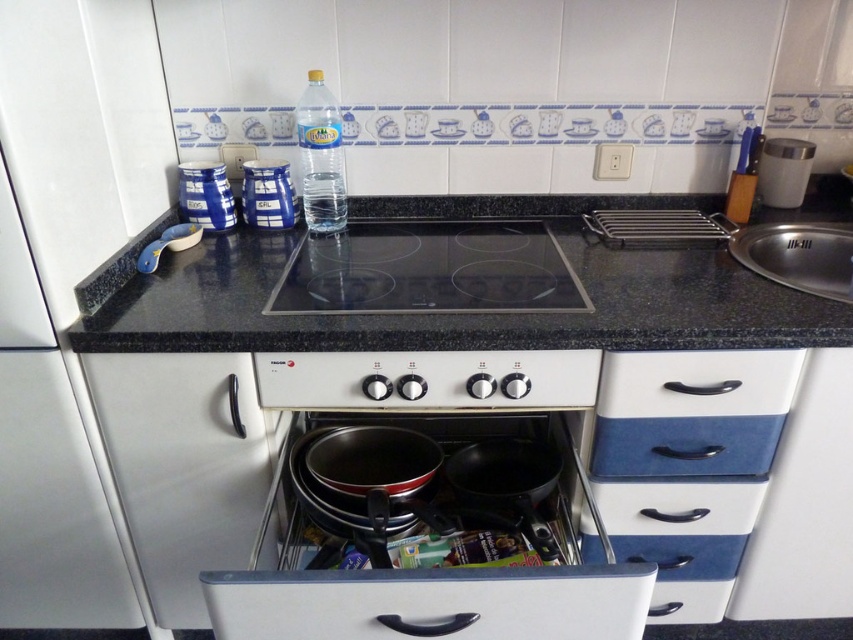
You are organizing items on the granite black countertop at center and need to place the blue glossy canister at center. Considering the space available, will the canister fit horizontally if placed in the middle of the countertop?

The granite black countertop at center is wider than the blue glossy canister at center, so the canister will fit horizontally when placed in the middle of the countertop.

You are a chef preparing a meal and need to place a tall soup pot on the granite black countertop at center and the blue glossy drawer at lower right. Which surface can accommodate the pot without it tipping over?

The granite black countertop at center has a greater height compared to the blue glossy drawer at lower right, so it can accommodate the tall soup pot without tipping over.

You are a chef preparing a dish and need to place a tall saucepan on the granite black countertop at center. The saucepan is 15 cm in height. Can the blue glossy canister at center fit underneath the saucepan without being knocked over?

The granite black countertop at center is taller than the blue glossy canister at center. Since the saucepan is 15 cm tall, it can be placed on the countertop, and the canister will be underneath without being knocked over as it is shorter.